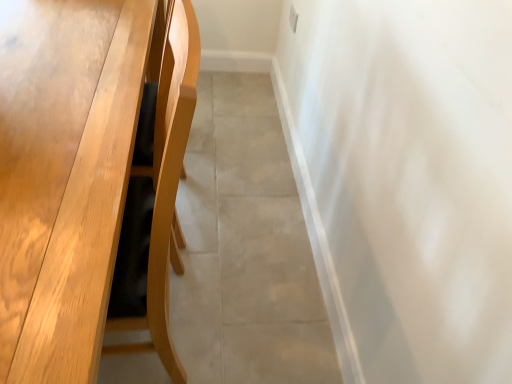
Question: Looking at their shapes, would you say light brown wood table at left is wider or thinner than beige tile floor at center?

Choices:
 (A) wide
 (B) thin

Answer: (A)

Question: From the image's perspective, relative to beige tile floor at center, is light brown wood table at left above or below?

Choices:
 (A) above
 (B) below

Answer: (B)

Question: Based on their positions, is light brown wood table at left located to the left or right of beige tile floor at center?

Choices:
 (A) right
 (B) left

Answer: (B)

Question: From a real-world perspective, is beige tile floor at center above or below light brown wood table at left?

Choices:
 (A) above
 (B) below

Answer: (B)

Question: In the image, is beige tile floor at center on the left side or the right side of light brown wood table at left?

Choices:
 (A) left
 (B) right

Answer: (B)

Question: Which is correct: beige tile floor at center is inside light brown wood table at left, or outside of it?

Choices:
 (A) outside
 (B) inside

Answer: (A)

Question: Is point (273, 122) positioned closer to the camera than point (174, 29)?

Choices:
 (A) farther
 (B) closer

Answer: (A)